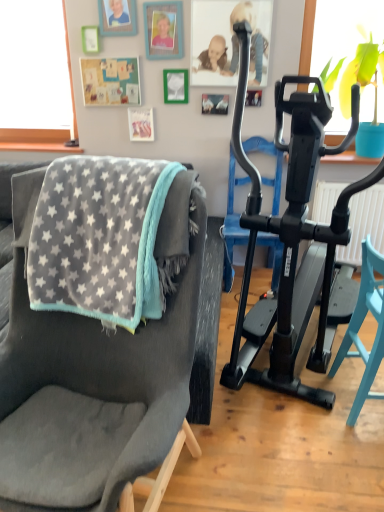
Question: Visually, is translucent glass window screen at upper right positioned to the left or to the right of black rubber exercise machine at right?

Choices:
 (A) left
 (B) right

Answer: (B)

Question: Which is correct: translucent glass window screen at upper right is inside black rubber exercise machine at right, or outside of it?

Choices:
 (A) inside
 (B) outside

Answer: (B)

Question: Estimate the real-world distances between objects in this image. Which object is farther from the gray fleece blanket at left?

Choices:
 (A) smooth skin baby at upper center
 (B) translucent glass window screen at upper right
 (C) teal wood chair at right, marked as the first chair in a right-to-left arrangement
 (D) black rubber exercise machine at right
 (E) black plastic stationary bicycle at right

Answer: (A)

Question: Based on their relative distances, which object is farther from the teal wood chair at right, the 2th chair from the left?

Choices:
 (A) black rubber exercise machine at right
 (B) black plastic stationary bicycle at right
 (C) gray fleece blanket at left
 (D) translucent glass window screen at upper right
 (E) soft gray fabric chair at left, placed as the second chair when sorted from right to left

Answer: (D)